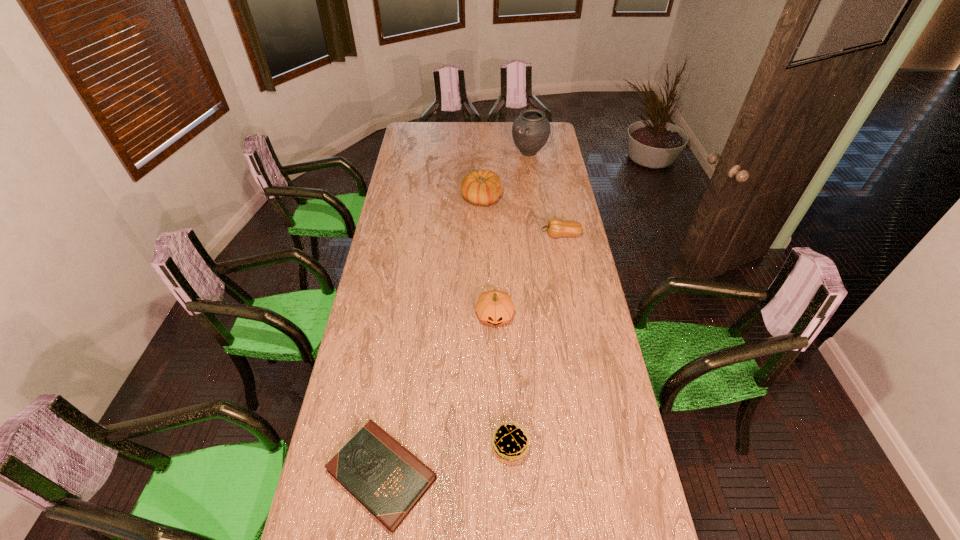
Where is `the tallest object`? the tallest object is located at coordinates (531, 130).

Find the location of a particular element. urn is located at coordinates (531, 130).

This screenshot has height=540, width=960. I want to click on the farthest gourd, so click(483, 187).

In order to click on the fourth farthest object in this screenshot , I will do `click(494, 307)`.

You are a GUI agent. You are given a task and a screenshot of the screen. Output one action in this format:
    pyautogui.click(x=<x>, y=<y>)
    Task: Click on the shortest gourd
    The width and height of the screenshot is (960, 540).
    Given the screenshot: What is the action you would take?
    pyautogui.click(x=556, y=227)

The height and width of the screenshot is (540, 960). Identify the location of the second farthest gourd. (556, 227).

The height and width of the screenshot is (540, 960). Find the location of `patty`. patty is located at coordinates (510, 444).

You are a GUI agent. You are given a task and a screenshot of the screen. Output one action in this format:
    pyautogui.click(x=<x>, y=<y>)
    Task: Click on the Bible
    This screenshot has height=540, width=960.
    Given the screenshot: What is the action you would take?
    pyautogui.click(x=388, y=480)

Identify the location of the shortest object. The width and height of the screenshot is (960, 540). (388, 480).

Find the location of a particular element. This screenshot has width=960, height=540. vacant space located on the left of the farthest object is located at coordinates (453, 153).